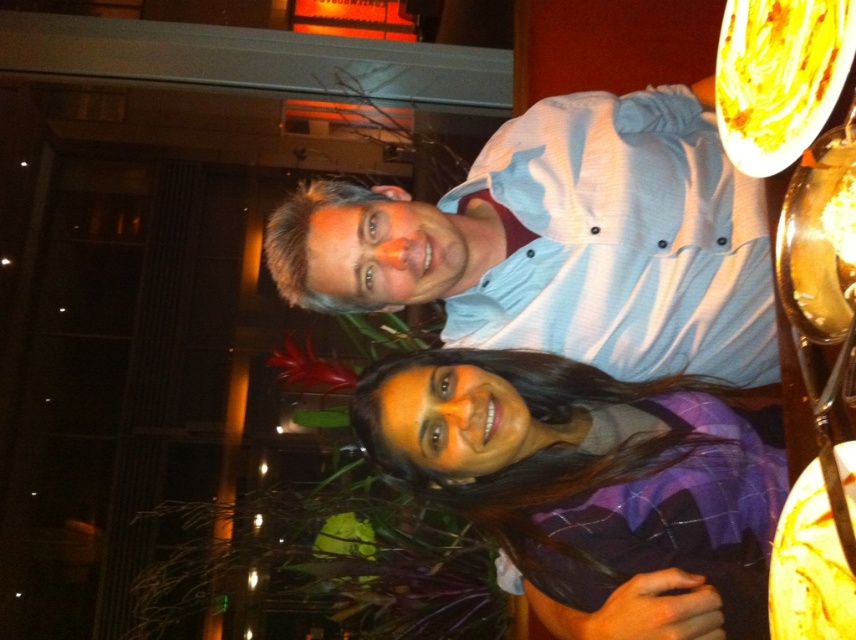
You are a photographer trying to focus on the light blue button up shirt at center. You notice a point at coordinates (562, 243). Is this point located on the light blue button up shirt at center?

Yes, the point at coordinates (562, 243) is located on the light blue button up shirt at center.